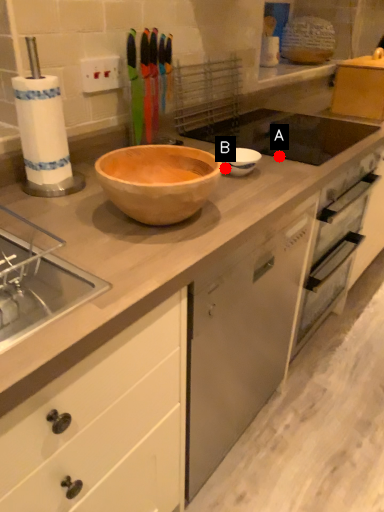
Question: Two points are circled on the image, labeled by A and B beside each circle. Among these points, which one is farthest from the camera?

Choices:
 (A) A is further
 (B) B is further

Answer: (A)